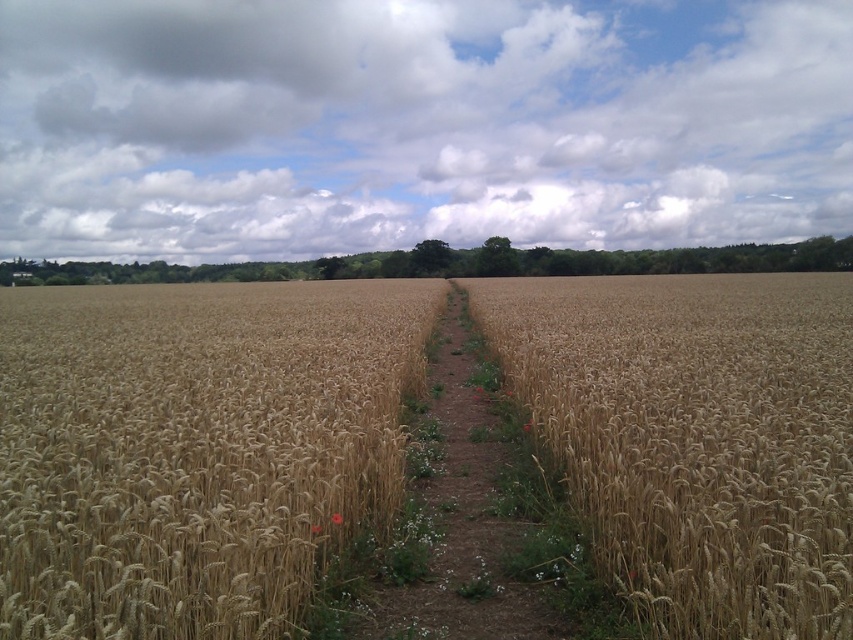
You are a farmer standing at the edge of the golden matte wheat at center, and you need to check the ripeness of the wheat. If your arm can reach 2 meters, can you reach the wheat without moving closer?

The golden matte wheat at center is 3.10 meters away from the camera. Since your arm can only reach 2 meters, you cannot reach the wheat without moving closer.